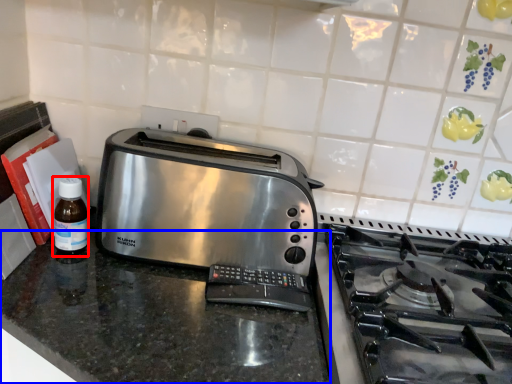
Question: Which object appears closest to the camera in this image, bottle (highlighted by a red box) or counter (highlighted by a blue box)?

Choices:
 (A) bottle
 (B) counter

Answer: (B)